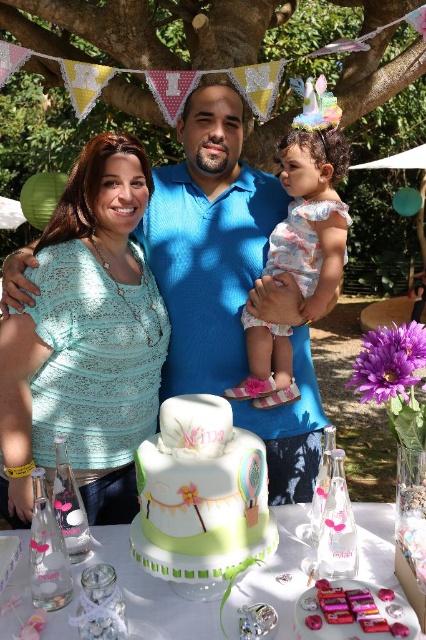
Question: Is white fondant cake at center bigger than matte white cake at center?

Choices:
 (A) yes
 (B) no

Answer: (B)

Question: Which object appears closest to the camera in this image?

Choices:
 (A) light blue lace shirt at center
 (B) green leafy tree at upper center
 (C) floral fabric dress at center
 (D) white fondant cake at center

Answer: (D)

Question: Which point is closer to the camera?

Choices:
 (A) (340, 243)
 (B) (146, 582)
 (C) (51, 284)
 (D) (279, 497)

Answer: (B)

Question: Does light blue lace shirt at center appear on the left side of green leafy tree at upper center?

Choices:
 (A) yes
 (B) no

Answer: (B)

Question: Among these points, which one is farthest from the camera?

Choices:
 (A) (195, 140)
 (B) (173, 573)
 (C) (155, 577)
 (D) (57, 212)

Answer: (A)

Question: Is blue textured shirt at center positioned at the back of green leafy tree at upper center?

Choices:
 (A) no
 (B) yes

Answer: (A)